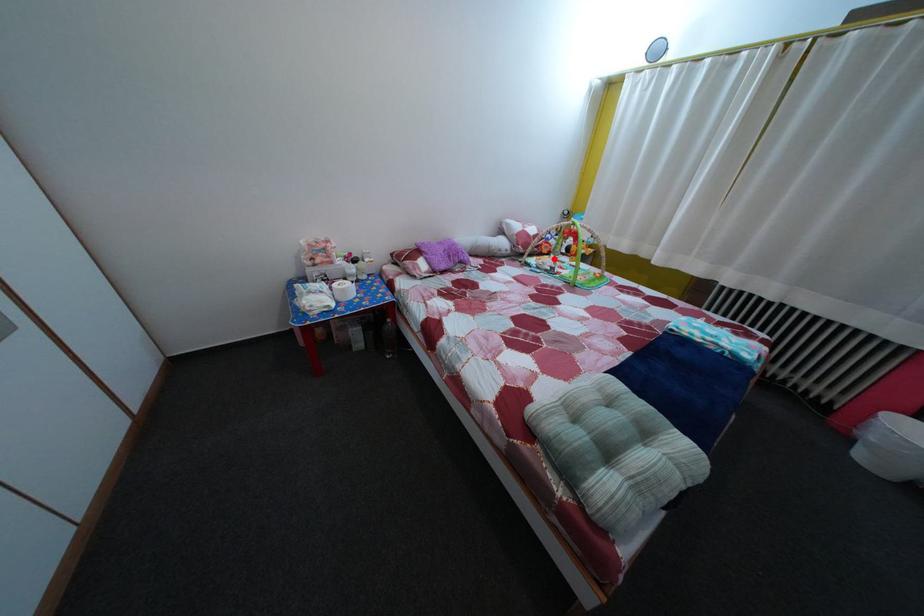
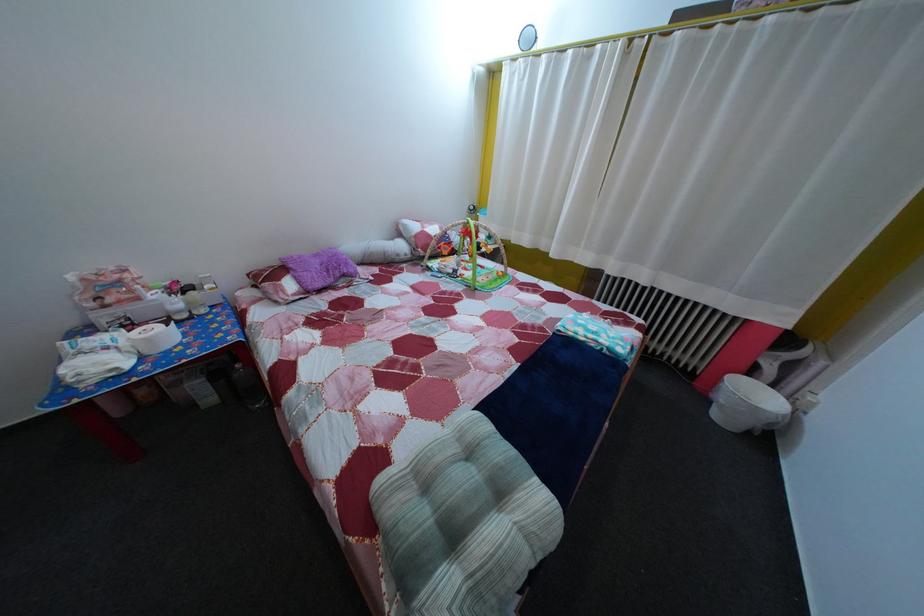
The point at the highlighted location is marked in the first image. Where is the corresponding point in the second image?

(455, 261)